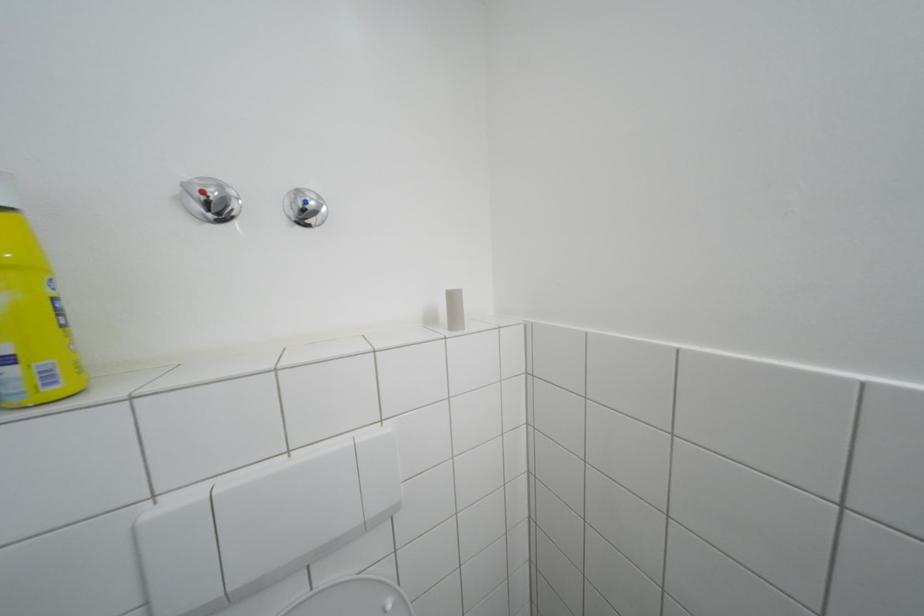
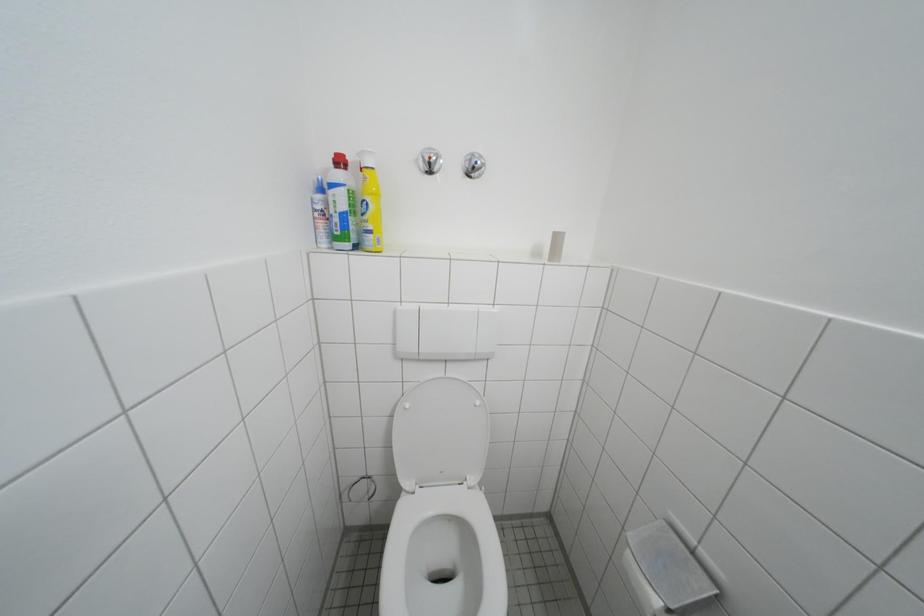
Question: Which direction would the cameraman need to move to produce the second image? Reply with the corresponding letter.

Choices:
 (A) Left
 (B) Right
 (C) Forward
 (D) Backward

Answer: (D)